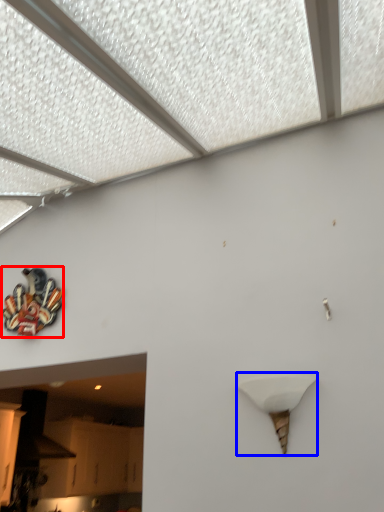
Question: Which object appears closest to the camera in this image, art (highlighted by a red box) or lamp (highlighted by a blue box)?

Choices:
 (A) art
 (B) lamp

Answer: (B)